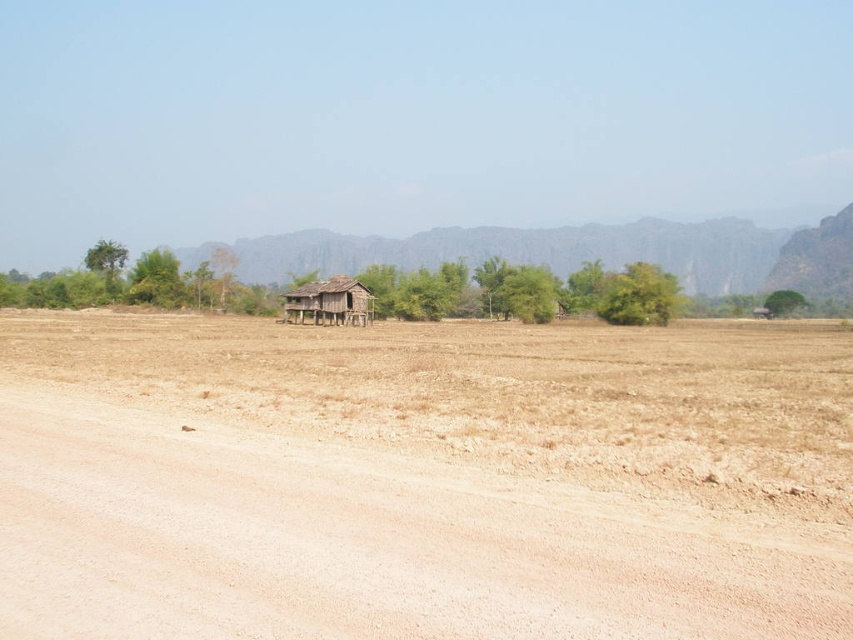
You are standing on the dirt road in the foreground and want to reach the rugged stone mountain at center and the weathered wood hut at center. Which one is closer to you?

The weathered wood hut at center is closer to you than the rugged stone mountain at center because the mountain is further away.

You are navigating a drone over a rural landscape with a dry, barren field and a dirt road. You need to deliver a package to the rugged stone mountain at center. According to the coordinates provided, where should you direct the drone to land?

The rugged stone mountain at center is located at point [578,252], so direct the drone to land there.

You are a hiker planning to cross the brown dirt field at center and the rugged stone mountain at center. Based on the scene, which path would be more challenging to traverse?

The rugged stone mountain at center would be more challenging to traverse than the brown dirt field at center because the mountain is elevated and likely has uneven terrain, while the field is flat and open.